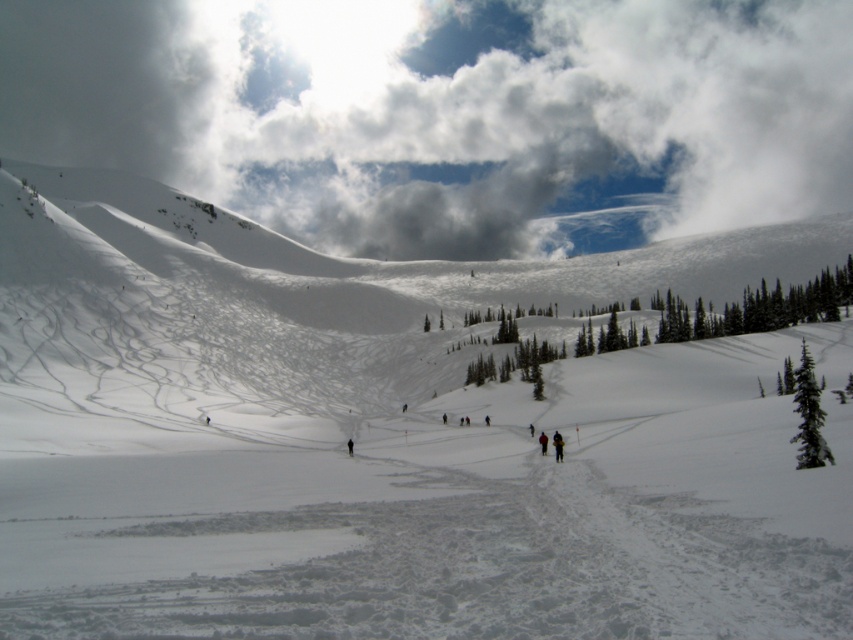
Looking at this image, you are a photographer trying to capture the perfect shot of the yellow jacket at center and the black fabric person at center. From the perspective of the photographer, which object is positioned to the right?

The yellow jacket at center is to the right of the black fabric person at center.

You are navigating a snowy path in the winter landscape. There are two points marked on your map at coordinates point (555, 433) and point (351, 452). Which point is closer to your current position if you are facing the direction of the path that the group of people are walking on?

Point (351, 452) is closer because it is in front of point (555, 433) when facing the direction of the path the group is walking on.